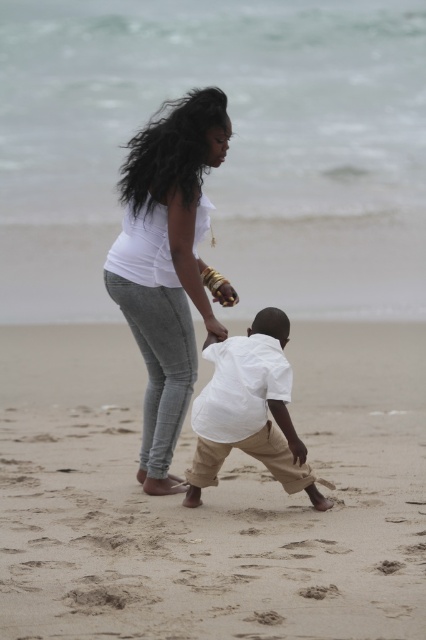
You are a photographer standing on the beach and want to take a photo of the white matte shirt at center and the sandy beige sand at center. If your camera can capture objects within a 3 meter range, will both objects be in the frame?

The sandy beige sand at center is 2.77 meters from the white matte shirt at center. Since the distance between them is within the 3 meter range, both objects will be in the frame.

You are a photographer trying to capture a photo of the white cotton shirt at center and the sandy beige sand at center. Which object is taller in the image?

The sandy beige sand at center is not as tall as the white cotton shirt at center, so the white cotton shirt at center is taller.

In the scene shown: You are a photographer trying to capture the entire scene of the sandy beige sand at center and the white matte shirt at center in one shot. Based on their sizes, which object would require you to adjust your camera angle to include more of it in the frame?

The sandy beige sand at center has a larger width than the white matte shirt at center, so you would need to adjust your camera angle to include more of the sandy beige sand at center in the frame.